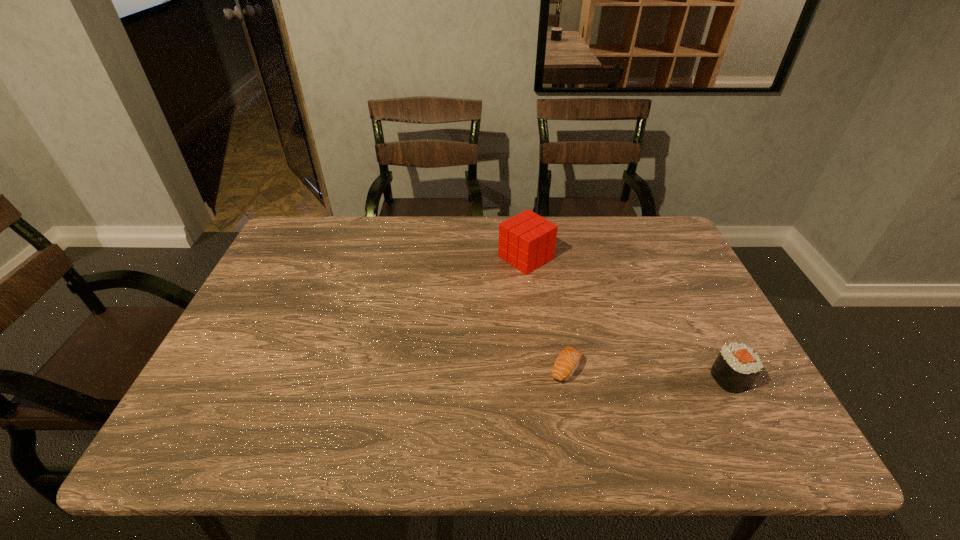
You are a GUI agent. You are given a task and a screenshot of the screen. Output one action in this format:
    pyautogui.click(x=<x>, y=<y>)
    Task: Click on the free spot that satisfies the following two spatial constraints: 1. on the front side of the left sushi; 2. on the left side of the farthest object
    This screenshot has width=960, height=540.
    Given the screenshot: What is the action you would take?
    pyautogui.click(x=540, y=368)